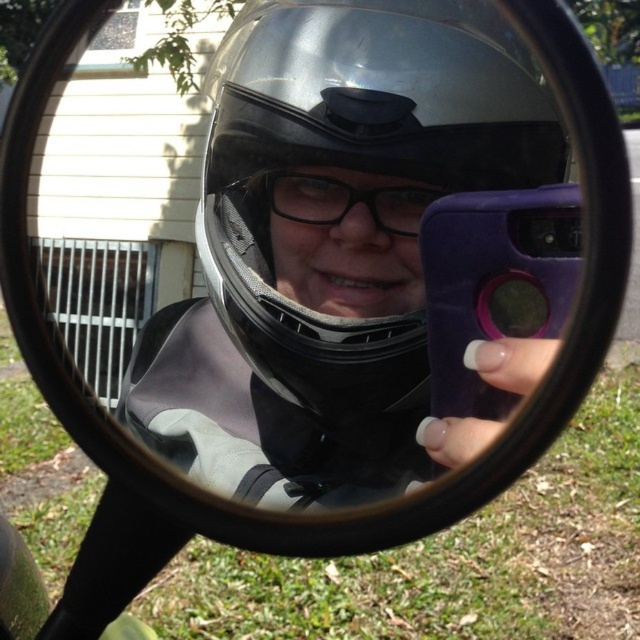
You are standing in front of a motorcycle mirror and want to check if your smartphone can fit in your pocket. The smartphone is at point [445,129] in the mirror. Your pocket is 12 inches wide. Can the smartphone fit in the pocket?

The smartphone at point [445,129] is 15.37 inches away from you, which is wider than your 12 inches wide pocket. Therefore, the smartphone cannot fit in the pocket.

From the picture: You are a photographer trying to capture a clear image of the transparent matte helmet at center. Based on the scene, what is the minimum distance you need to maintain from the helmet to ensure the camera can focus properly?

The minimum distance you need to maintain from the transparent matte helmet at center is 12.82 inches to ensure the camera can focus properly.